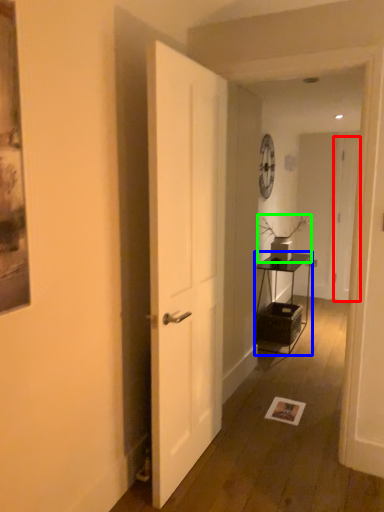
Question: Which object is the closest to the door (highlighted by a red box)? Choose among these: table (highlighted by a blue box) or houseplant (highlighted by a green box).

Choices:
 (A) table
 (B) houseplant

Answer: (A)